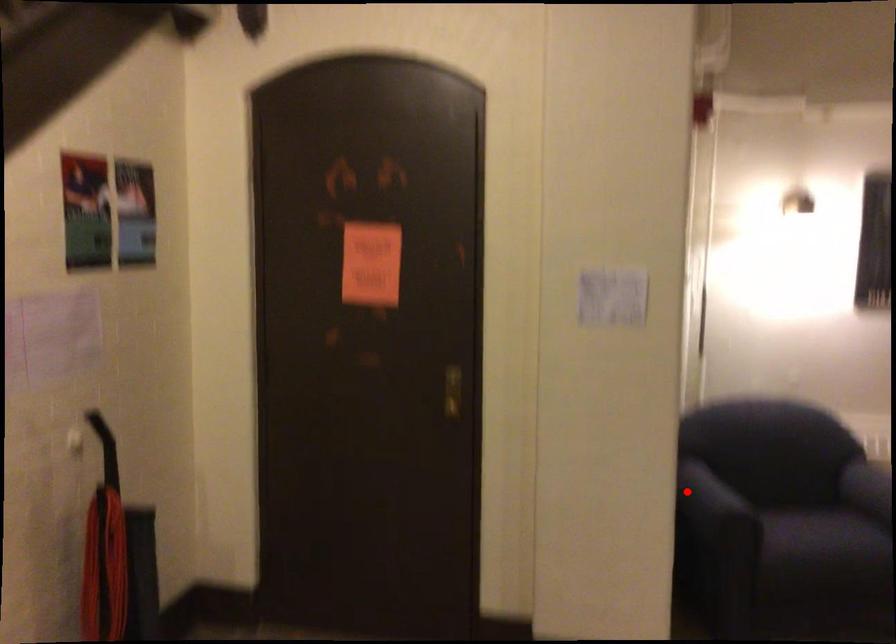
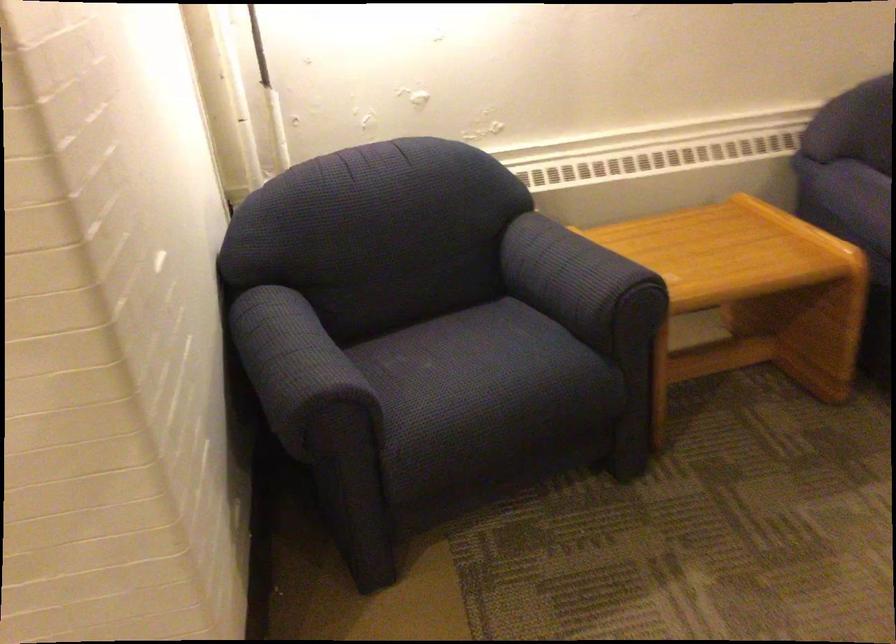
Locate, in the second image, the point that corresponds to the highlighted location in the first image.

(294, 363)